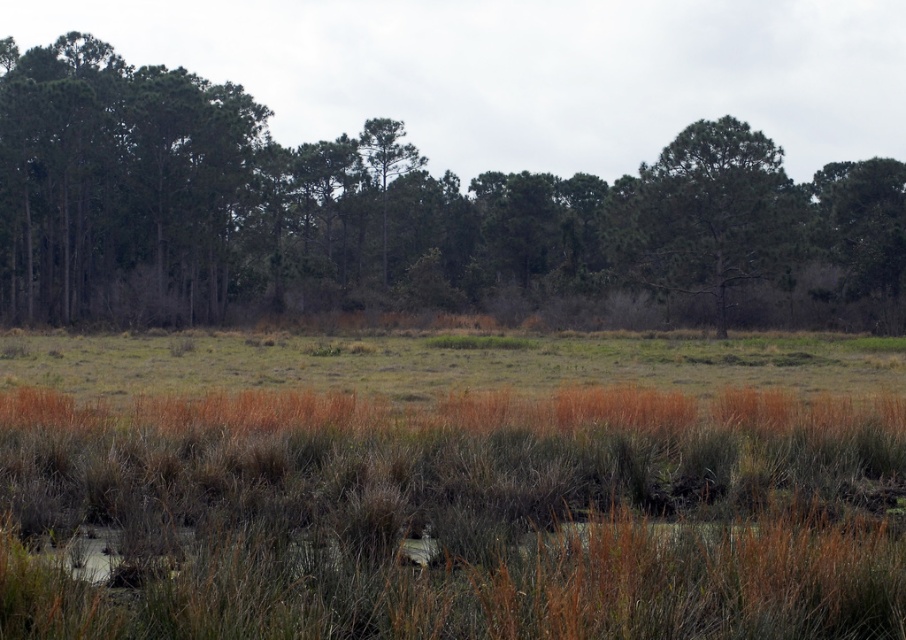
Which is behind, point (728, 280) or point (851, 294)?

Point (851, 294)

Which is in front, point (689, 131) or point (831, 224)?

Point (689, 131) is in front.

Where is `green matte tree at upper right`? The height and width of the screenshot is (640, 906). green matte tree at upper right is located at coordinates (709, 214).

Identify the location of green matte tree at upper right. This screenshot has width=906, height=640. (709, 214).

Which is behind, point (718, 220) or point (903, 180)?

The point (903, 180) is behind.

Can you confirm if green leafy tree at center is taller than green leafy tree at upper right?

Yes.

Is point (71, 112) positioned before point (879, 211)?

Yes, it is.

I want to click on green leafy tree at center, so click(398, 214).

Between green leafy tree at center and green matte tree at upper right, which one is positioned lower?

green matte tree at upper right is lower down.

Locate an element on the screen. This screenshot has height=640, width=906. green leafy tree at center is located at coordinates (398, 214).

You are a GUI agent. You are given a task and a screenshot of the screen. Output one action in this format:
    pyautogui.click(x=<x>, y=<y>)
    Task: Click on the green leafy tree at center
    This screenshot has width=906, height=640.
    Given the screenshot: What is the action you would take?
    pyautogui.click(x=398, y=214)